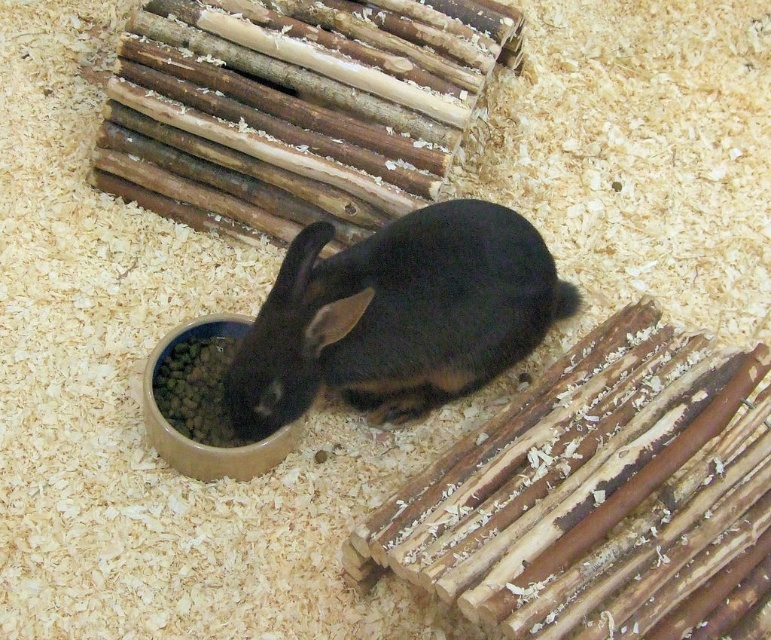
The image size is (771, 640). Describe the element at coordinates (396, 316) in the screenshot. I see `black matte rabbit at center` at that location.

I want to click on black matte rabbit at center, so click(x=396, y=316).